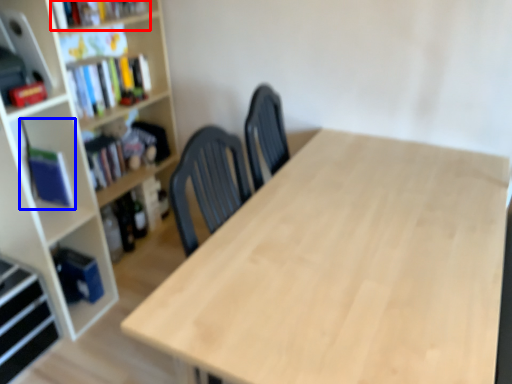
Question: Among these objects, which one is farthest to the camera, book (highlighted by a red box) or book (highlighted by a blue box)?

Choices:
 (A) book
 (B) book

Answer: (B)